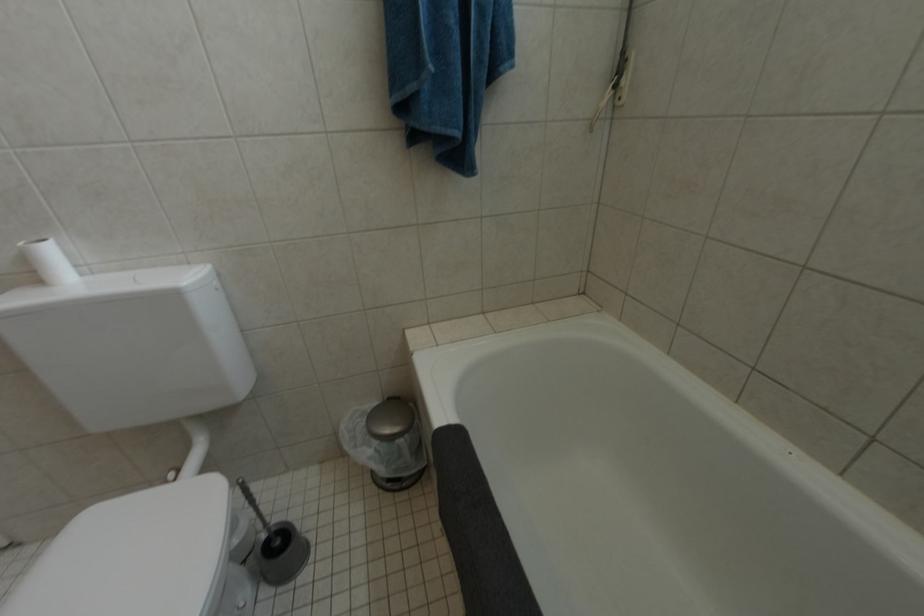
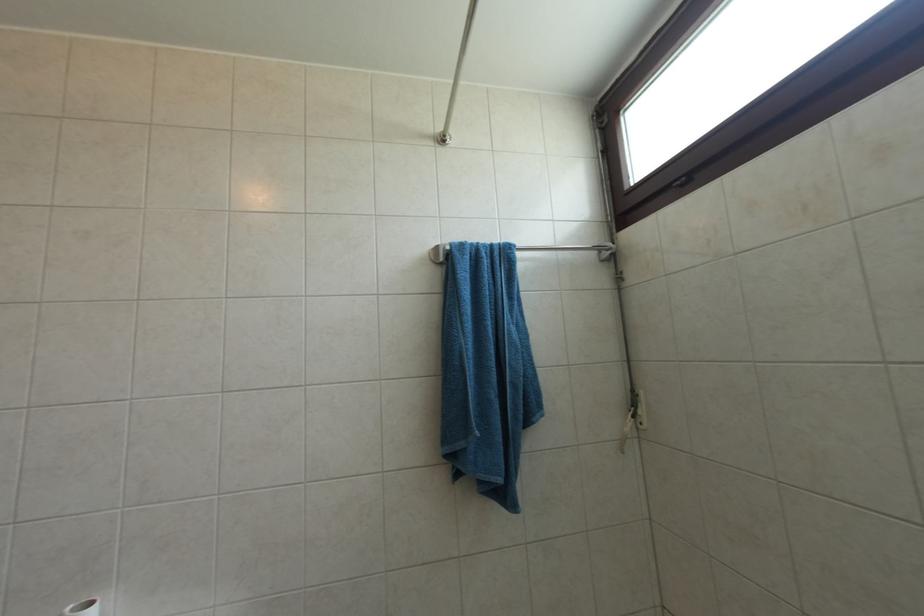
Question: The first image is from the beginning of the video and the second image is from the end. How did the camera likely rotate when shooting the video?

Choices:
 (A) Left
 (B) Right
 (C) Up
 (D) Down

Answer: (C)